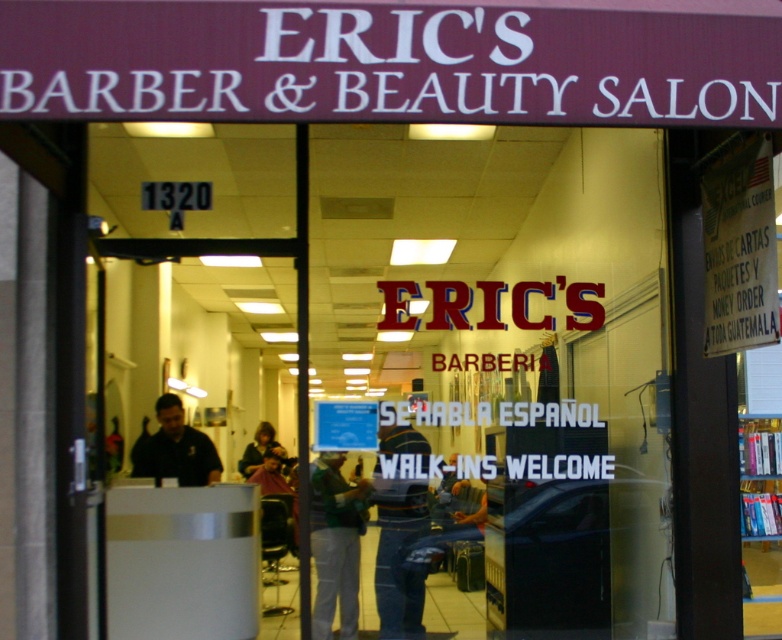
Is green fabric shirt at center to the left of dark blue shirt at center from the viewer's perspective?

In fact, green fabric shirt at center is to the right of dark blue shirt at center.

Can you confirm if green fabric shirt at center is positioned below dark blue shirt at center?

Correct, green fabric shirt at center is located below dark blue shirt at center.

Measure the distance between green fabric shirt at center and camera.

4.63 meters

Locate an element on the screen. Image resolution: width=782 pixels, height=640 pixels. green fabric shirt at center is located at coordinates (335, 544).

Is blue jeans at center thinner than dark brown hair at center?

Yes.

The width and height of the screenshot is (782, 640). In order to click on blue jeans at center in this screenshot , I will do `click(400, 557)`.

Is blue jeans at center thinner than dark blue shirt at center?

Yes.

Does blue jeans at center have a lesser height compared to dark blue shirt at center?

No, blue jeans at center is not shorter than dark blue shirt at center.

Identify the location of blue jeans at center. The width and height of the screenshot is (782, 640). (400, 557).